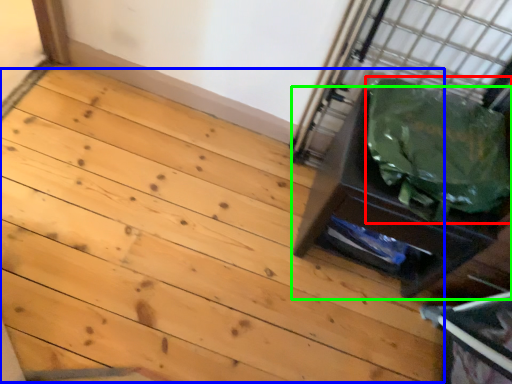
Question: Considering the real-world distances, which object is closest to garbage (highlighted by a red box)? stairwell (highlighted by a blue box) or furniture (highlighted by a green box).

Choices:
 (A) stairwell
 (B) furniture

Answer: (B)